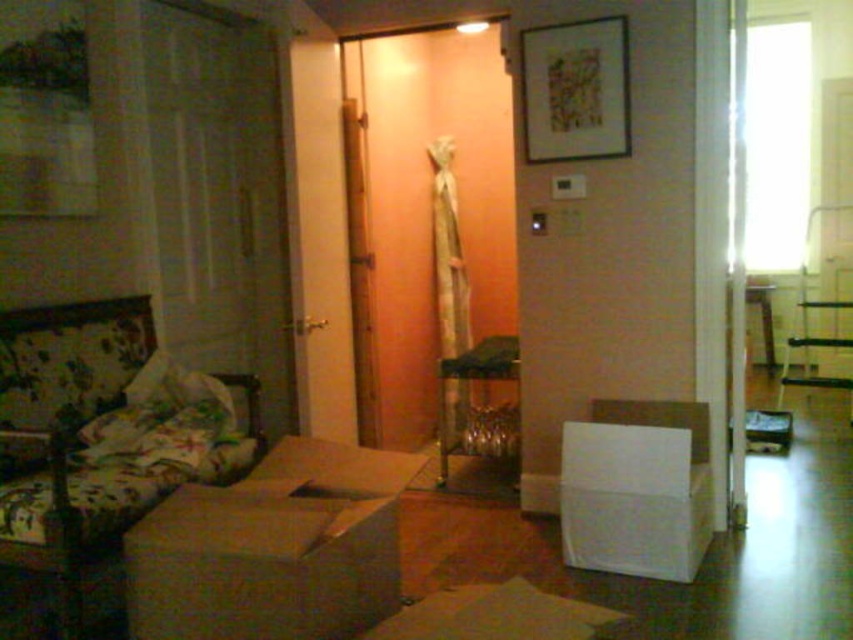
Question: Does floral fabric couch at left appear under white cardboard box at center?

Choices:
 (A) no
 (B) yes

Answer: (A)

Question: Which point appears farthest from the camera in this image?

Choices:
 (A) (585, 29)
 (B) (373, 589)
 (C) (489, 428)
 (D) (618, 408)

Answer: (C)

Question: Which of the following is the farthest from the observer?

Choices:
 (A) (666, 442)
 (B) (440, 449)
 (C) (18, 310)

Answer: (B)

Question: Is brown cardboard box at lower left to the left of metallic glass table at center from the viewer's perspective?

Choices:
 (A) yes
 (B) no

Answer: (A)

Question: Which point appears closest to the camera in this image?

Choices:
 (A) (607, 29)
 (B) (666, 458)

Answer: (B)

Question: Does floral fabric couch at left appear on the right side of matte wooden picture frame at upper center?

Choices:
 (A) yes
 (B) no

Answer: (B)